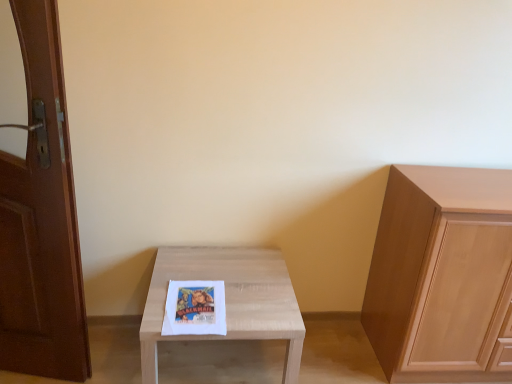
What do you see at coordinates (41, 219) in the screenshot?
I see `brown wooden door at left` at bounding box center [41, 219].

What is the approximate width of light wood cabinet at right?

It is 19.74 inches.

Locate an element on the screen. light wood table at center is located at coordinates (228, 300).

Locate an element on the screen. The height and width of the screenshot is (384, 512). brown wooden door at left is located at coordinates (41, 219).

From their relative heights in the image, would you say light wood table at center is taller or shorter than brown wooden door at left?

light wood table at center is shorter than brown wooden door at left.

Can you confirm if light wood table at center is positioned to the left of brown wooden door at left?

No.

Is light wood table at center beside brown wooden door at left?

No, light wood table at center is not beside brown wooden door at left.

From a real-world perspective, is light wood cabinet at right physically below brown wooden door at left?

Yes.

Is light wood cabinet at right positioned behind brown wooden door at left?

Yes, it is.

From the picture: Is light wood cabinet at right completely or partially outside of brown wooden door at left?

Yes, light wood cabinet at right is not within brown wooden door at left.

Would you say brown wooden door at left is inside or outside light wood table at center?

brown wooden door at left is not inside light wood table at center, it's outside.

Is light wood table at center at the back of brown wooden door at left?

No, brown wooden door at left's orientation is not away from light wood table at center.

Consider the image. Considering the relative sizes of brown wooden door at left and light wood table at center in the image provided, is brown wooden door at left taller than light wood table at center?

Yes.

Considering the positions of points (32, 68) and (421, 285), is point (32, 68) closer to camera compared to point (421, 285)?

Yes, point (32, 68) is closer to viewer.

From a real-world perspective, who is located lower, brown wooden door at left or light wood cabinet at right?

From a 3D spatial view, light wood cabinet at right is below.

Would you say brown wooden door at left is a long distance from light wood cabinet at right?

Absolutely, brown wooden door at left is distant from light wood cabinet at right.

From the image's perspective, is brown wooden door at left over light wood cabinet at right?

Yes.

Which point is more forward, (418, 284) or (276, 333)?

Point (276, 333)

From a real-world perspective, is light wood cabinet at right on light wood table at center?

Indeed, from a real-world perspective, light wood cabinet at right stands above light wood table at center.

Who is more distant, light wood cabinet at right or light wood table at center?

light wood cabinet at right is behind.

Looking at this image, is light wood cabinet at right placed right next to light wood table at center?

There is a gap between light wood cabinet at right and light wood table at center.

Looking at their sizes, would you say light wood table at center is wider or thinner than light wood cabinet at right?

Clearly, light wood table at center has more width compared to light wood cabinet at right.

Which is behind, point (260, 324) or point (454, 350)?

The point (454, 350) is behind.

Which object is more forward, light wood table at center or light wood cabinet at right?

light wood table at center.

The image size is (512, 384). In the image, there is a brown wooden door at left. What are the coordinates of `table below it (from a real-world perspective)` in the screenshot? It's located at (228, 300).

You are a GUI agent. You are given a task and a screenshot of the screen. Output one action in this format:
    pyautogui.click(x=<x>, y=<y>)
    Task: Click on the cabinetry that is behind the brown wooden door at left
    This screenshot has width=512, height=384.
    Given the screenshot: What is the action you would take?
    pyautogui.click(x=442, y=276)

Considering their positions, is light wood cabinet at right positioned closer to light wood table at center than brown wooden door at left?

The object closer to light wood table at center is brown wooden door at left.

Based on their spatial positions, is light wood table at center or light wood cabinet at right further from brown wooden door at left?

The object further to brown wooden door at left is light wood cabinet at right.

Estimate the real-world distances between objects in this image. Which object is further from light wood cabinet at right, light wood table at center or brown wooden door at left?

brown wooden door at left.

Which object lies nearer to the anchor point light wood cabinet at right, brown wooden door at left or light wood table at center?

light wood table at center lies closer to light wood cabinet at right than the other object.

From the image, which object appears to be nearer to brown wooden door at left, light wood cabinet at right or light wood table at center?

Among the two, light wood table at center is located nearer to brown wooden door at left.

In the scene shown: From the image, which object appears to be nearer to light wood table at center, brown wooden door at left or light wood cabinet at right?

brown wooden door at left is closer to light wood table at center.

You are a GUI agent. You are given a task and a screenshot of the screen. Output one action in this format:
    pyautogui.click(x=<x>, y=<y>)
    Task: Click on the table situated between brown wooden door at left and light wood cabinet at right from left to right
    The image size is (512, 384).
    Given the screenshot: What is the action you would take?
    pos(228,300)